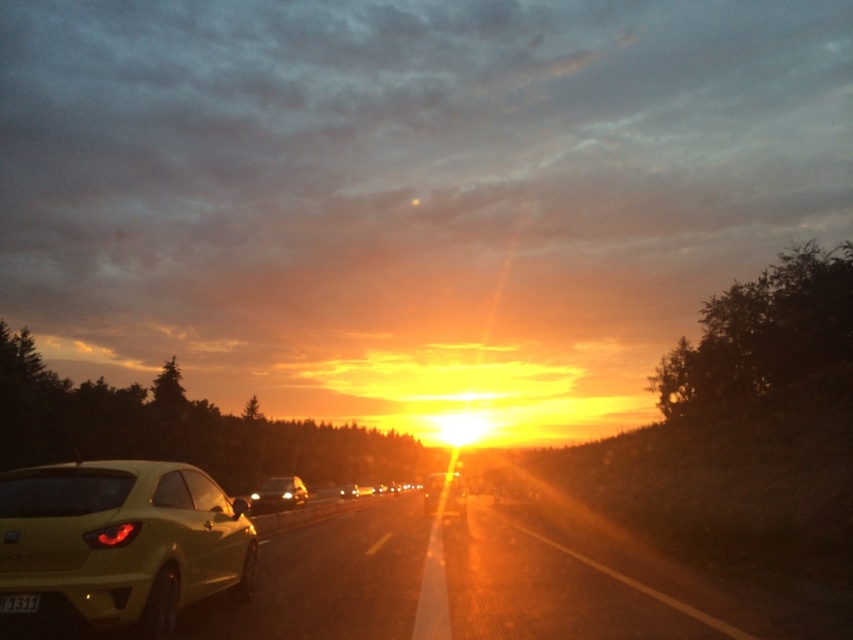
Can you confirm if metallic yellow hatchback at lower left is shorter than matte yellow car at center?

Yes, metallic yellow hatchback at lower left is shorter than matte yellow car at center.

Does metallic yellow hatchback at lower left appear on the right side of matte yellow car at center?

No, metallic yellow hatchback at lower left is not to the right of matte yellow car at center.

Who is more distant from viewer, (22, 508) or (271, 486)?

The point (271, 486) is behind.

Identify the location of metallic yellow hatchback at lower left. (119, 544).

Does matte yellow car at center appear under metallic gold car at center?

Correct, matte yellow car at center is located below metallic gold car at center.

Locate an element on the screen. Image resolution: width=853 pixels, height=640 pixels. matte yellow car at center is located at coordinates (277, 493).

Which is in front, point (270, 508) or point (427, 477)?

Point (270, 508) is more forward.

At what (x,y) coordinates should I click in order to perform the action: click on matte yellow car at center. Please return your answer as a coordinate pair (x, y). The width and height of the screenshot is (853, 640). Looking at the image, I should click on (277, 493).

Does metallic yellow hatchback at lower left appear over metallic gold car at center?

Yes.

Who is positioned more to the left, metallic yellow hatchback at lower left or metallic gold car at center?

From the viewer's perspective, metallic yellow hatchback at lower left appears more on the left side.

I want to click on metallic yellow hatchback at lower left, so click(x=119, y=544).